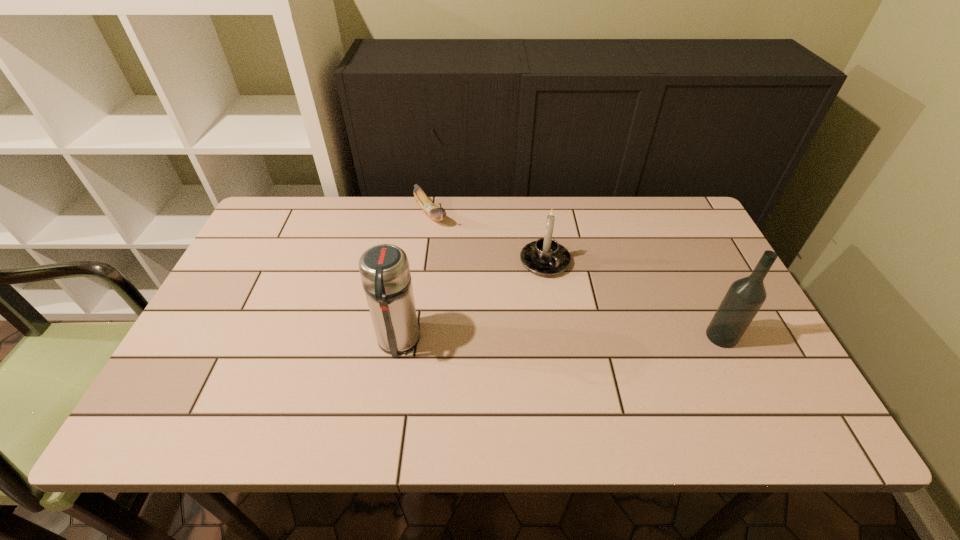
At what (x,y) coordinates should I click in order to perform the action: click on thermos bottle. Please return your answer as a coordinate pair (x, y). The height and width of the screenshot is (540, 960). Looking at the image, I should click on (384, 269).

The image size is (960, 540). Find the location of `the rightmost object`. the rightmost object is located at coordinates (744, 298).

You are a GUI agent. You are given a task and a screenshot of the screen. Output one action in this format:
    pyautogui.click(x=<x>, y=<y>)
    Task: Click on the shortest object
    The height and width of the screenshot is (540, 960).
    Given the screenshot: What is the action you would take?
    pyautogui.click(x=430, y=209)

Where is `the farthest object`? This screenshot has width=960, height=540. the farthest object is located at coordinates (430, 209).

Locate an element on the screen. Image resolution: width=960 pixels, height=540 pixels. the second shortest object is located at coordinates (546, 257).

Find the location of a particular element. This screenshot has width=960, height=540. the second farthest object is located at coordinates (546, 257).

Locate an element on the screen. The height and width of the screenshot is (540, 960). vacant space located 0.060m with a handle on the side of the thermos bottle is located at coordinates (391, 389).

What are the coordinates of `free spot located 0.070m on the back of the vodka` in the screenshot? It's located at (706, 303).

Where is `vacant space located 0.180m at the stem of the shortest object`? This screenshot has height=540, width=960. vacant space located 0.180m at the stem of the shortest object is located at coordinates (468, 265).

Where is `vacant area situated at the stem of the shortest object`? The height and width of the screenshot is (540, 960). vacant area situated at the stem of the shortest object is located at coordinates (473, 271).